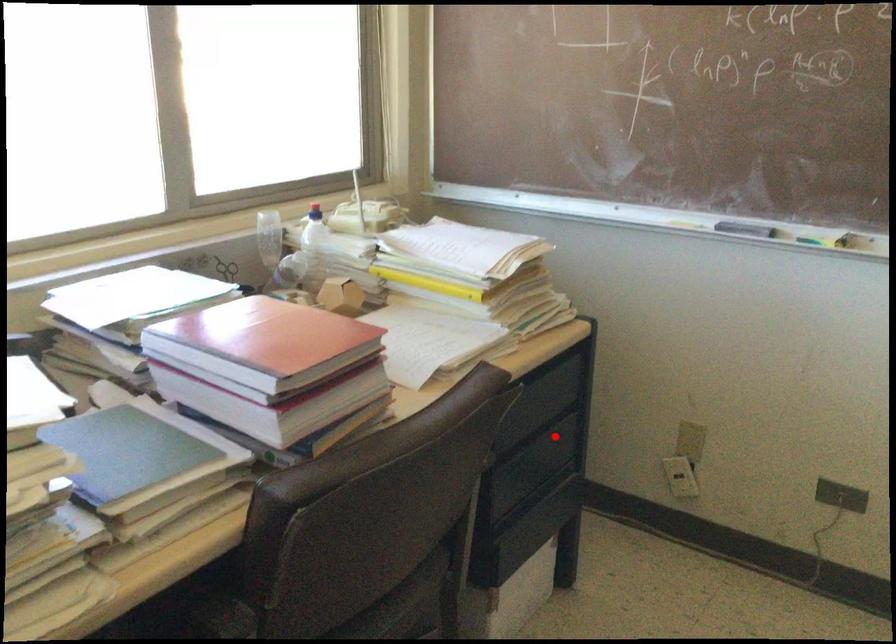
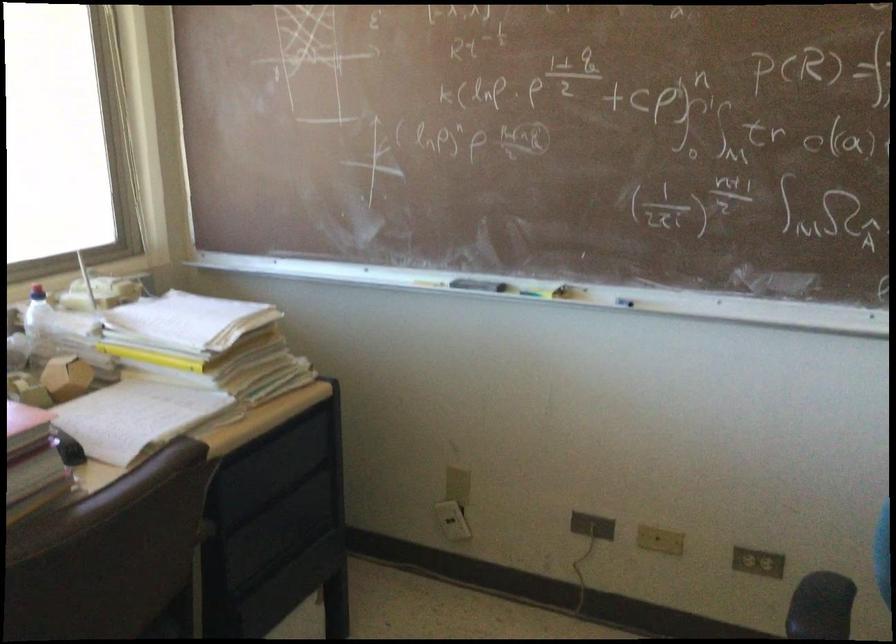
In the second image, find the point that corresponds to the highlighted location in the first image.

(298, 506)